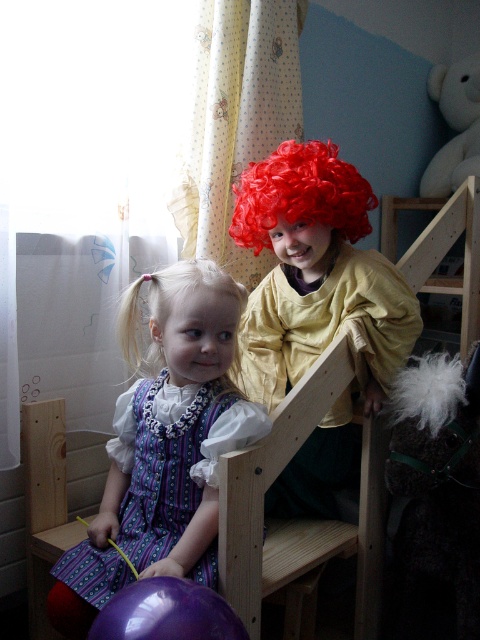
Is point (227, 548) farther from camera compared to point (135, 609)?

Yes, it is.

In the scene shown: Can you confirm if wooden chair at center is smaller than purple glossy balloon at lower left?

No, wooden chair at center is not smaller than purple glossy balloon at lower left.

Image resolution: width=480 pixels, height=640 pixels. I want to click on wooden chair at center, so click(297, 518).

Between point (294, 481) and point (364, 180), which one is positioned in front?

Point (364, 180) is more forward.

Can you confirm if curly red wig at upper right is smaller than curly red wig at upper center?

Actually, curly red wig at upper right might be larger than curly red wig at upper center.

Which is in front, point (240, 220) or point (356, 182)?

Point (356, 182) is in front.

This screenshot has width=480, height=640. I want to click on curly red wig at upper right, so (316, 275).

Is patterned fabric dress at center positioned in front of white plush bear at upper right?

Yes.

Does patterned fabric dress at center have a greater width compared to white plush bear at upper right?

Yes, patterned fabric dress at center is wider than white plush bear at upper right.

Describe the element at coordinates (165, 470) in the screenshot. I see `patterned fabric dress at center` at that location.

This screenshot has height=640, width=480. Identify the location of patterned fabric dress at center. (165, 470).